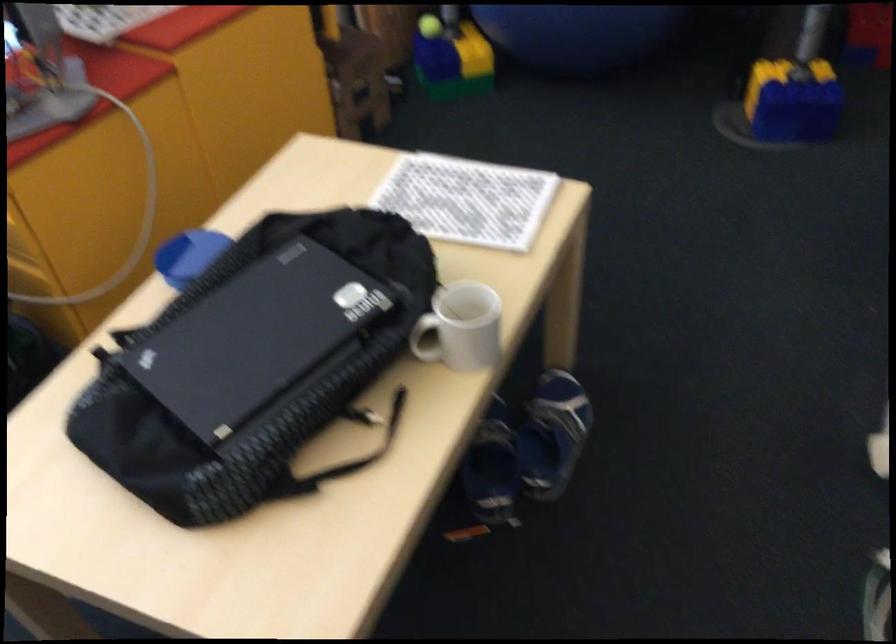
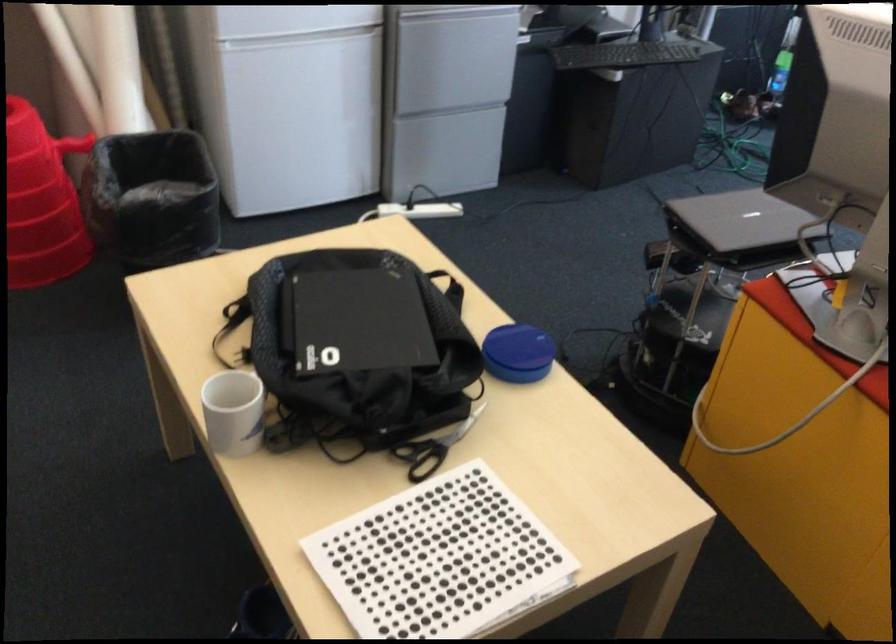
Find the pixel in the second image that matches point (493, 315) in the first image.

(234, 412)